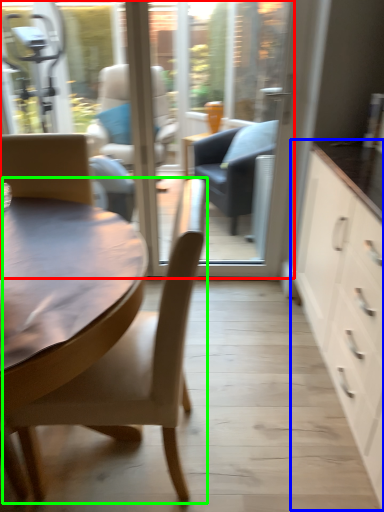
Question: Estimate the real-world distances between objects in this image. Which object is closer to window screen (highlighted by a red box), cabinetry (highlighted by a blue box) or chair (highlighted by a green box)?

Choices:
 (A) cabinetry
 (B) chair

Answer: (A)